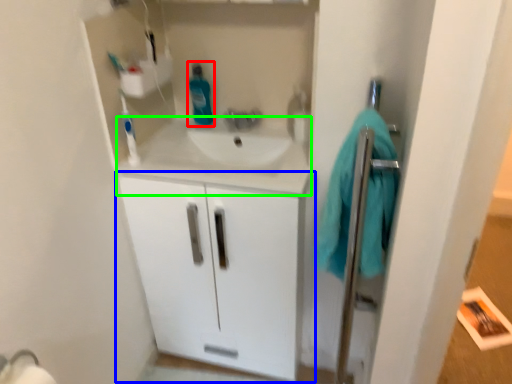
Question: Which object is positioned farthest from cleaning product (highlighted by a red box)? Select from bathroom cabinet (highlighted by a blue box) and counter top (highlighted by a green box).

Choices:
 (A) bathroom cabinet
 (B) counter top

Answer: (A)